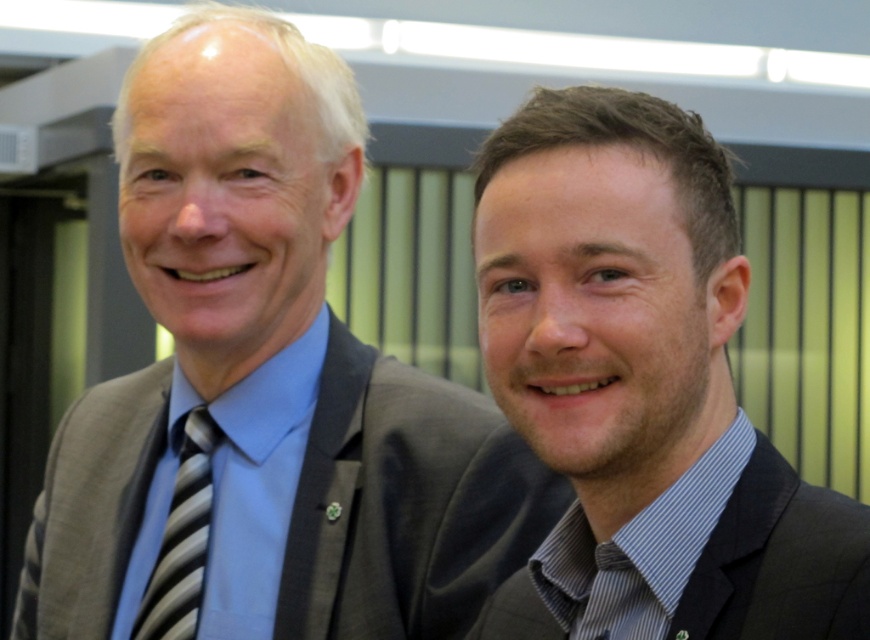
Which is above, gray suit at left or dark brown suit at right?

gray suit at left is above.

Is gray suit at left below dark brown suit at right?

No.

Describe the element at coordinates (264, 388) in the screenshot. The width and height of the screenshot is (870, 640). I see `gray suit at left` at that location.

I want to click on gray suit at left, so click(x=264, y=388).

This screenshot has height=640, width=870. What do you see at coordinates (641, 387) in the screenshot? I see `dark brown suit at right` at bounding box center [641, 387].

Find the location of `dark brown suit at right`. dark brown suit at right is located at coordinates (641, 387).

Where is `dark brown suit at right`? dark brown suit at right is located at coordinates (641, 387).

Between point (135, 131) and point (788, 566), which one is positioned behind?

Point (135, 131)

Is point (286, 492) farther from camera compared to point (667, 564)?

Yes, it is.

Find the location of `gray suit at left`. gray suit at left is located at coordinates (264, 388).